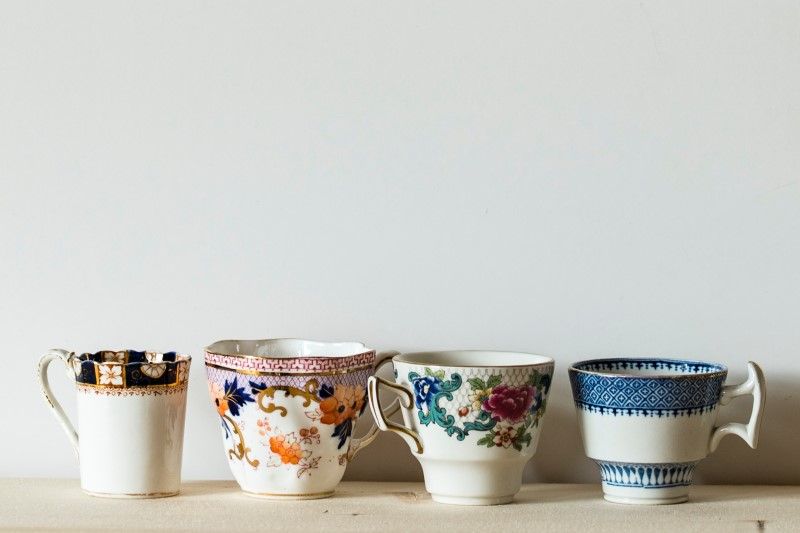
Locate an element on the screen. The height and width of the screenshot is (533, 800). teacups is located at coordinates (146, 409), (301, 421), (473, 447), (649, 435).